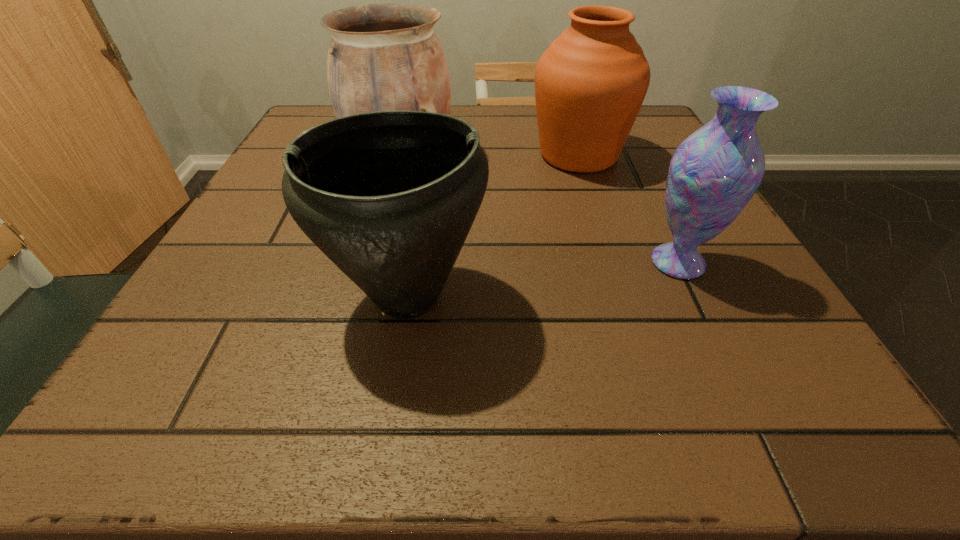
Locate an element on the screen. object at the far right corner is located at coordinates (590, 83).

Image resolution: width=960 pixels, height=540 pixels. I want to click on blank space at the far edge, so click(476, 106).

The image size is (960, 540). I want to click on vacant space at the near edge of the desktop, so click(417, 390).

Identify the location of free point at the right edge. This screenshot has width=960, height=540. (742, 271).

At what (x,y) coordinates should I click in order to perform the action: click on blank space at the far left corner. Please return your answer as a coordinate pair (x, y). This screenshot has height=540, width=960. Looking at the image, I should click on (310, 125).

Identify the location of free spot at the near left corner of the desktop. (170, 369).

Where is `vacant space that's between the rightmost urn and the nearest urn`? The image size is (960, 540). vacant space that's between the rightmost urn and the nearest urn is located at coordinates (492, 226).

This screenshot has height=540, width=960. What are the coordinates of `empty space between the rightmost urn and the nearest urn` in the screenshot? It's located at (492, 226).

Locate an element on the screen. The image size is (960, 540). object that is the nearest to the rightmost urn is located at coordinates (382, 57).

Identify the location of object that stands as the second closest to the nearest urn. This screenshot has height=540, width=960. (590, 83).